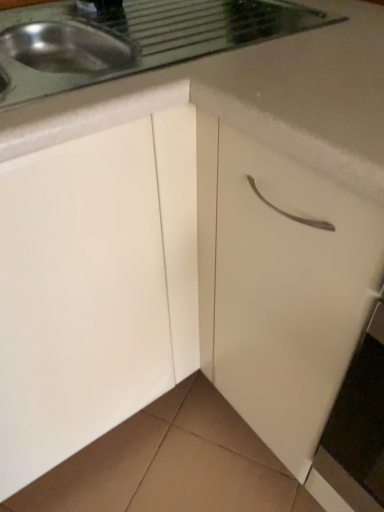
The width and height of the screenshot is (384, 512). Describe the element at coordinates (216, 77) in the screenshot. I see `white glossy countertop at upper center` at that location.

You are a GUI agent. You are given a task and a screenshot of the screen. Output one action in this format:
    pyautogui.click(x=<x>, y=<y>)
    Task: Click on the white glossy countertop at upper center
    
    Given the screenshot: What is the action you would take?
    pyautogui.click(x=216, y=77)

Measure the distance between point (202,57) and camera.

Point (202,57) and camera are 26.77 inches apart from each other.

This screenshot has width=384, height=512. I want to click on white matte drawer at center, so click(288, 293).

Describe the element at coordinates (288, 293) in the screenshot. I see `white matte drawer at center` at that location.

At what (x,y) coordinates should I click in order to perform the action: click on white glossy countertop at upper center. Please return your answer as a coordinate pair (x, y). Looking at the image, I should click on (216, 77).

Between white glossy countertop at upper center and white matte drawer at center, which one appears on the right side from the viewer's perspective?

From the viewer's perspective, white matte drawer at center appears more on the right side.

In the image, is white glossy countertop at upper center positioned in front of or behind white matte drawer at center?

Clearly, white glossy countertop at upper center is behind white matte drawer at center.

Which is closer, (x=251, y=102) or (x=261, y=272)?

Point (x=251, y=102) is positioned closer to the camera compared to point (x=261, y=272).

From the image's perspective, relative to white matte drawer at center, is white glossy countertop at upper center above or below?

Based on their image positions, white glossy countertop at upper center is located above white matte drawer at center.

From a real-world perspective, between white glossy countertop at upper center and white matte drawer at center, who is vertically higher?

white glossy countertop at upper center is physically above.

Considering the relative sizes of white glossy countertop at upper center and white matte drawer at center in the image provided, is white glossy countertop at upper center thinner than white matte drawer at center?

In fact, white glossy countertop at upper center might be wider than white matte drawer at center.

Considering the sizes of white glossy countertop at upper center and white matte drawer at center in the image, is white glossy countertop at upper center taller or shorter than white matte drawer at center?

Clearly, white glossy countertop at upper center is shorter compared to white matte drawer at center.

Between white glossy countertop at upper center and white matte drawer at center, which one has larger size?

white matte drawer at center.

Is white glossy countertop at upper center not within white matte drawer at center?

Absolutely, white glossy countertop at upper center is external to white matte drawer at center.

Is white glossy countertop at upper center with white matte drawer at center?

white glossy countertop at upper center is not next to white matte drawer at center, and they're not touching.

Is white glossy countertop at upper center oriented away from white matte drawer at center?

No, white matte drawer at center is not at the back of white glossy countertop at upper center.

Where is `drawer below the white glossy countertop at upper center (from the image's perspective)`? This screenshot has width=384, height=512. drawer below the white glossy countertop at upper center (from the image's perspective) is located at coordinates (288, 293).

Is white matte drawer at center at the left side of white glossy countertop at upper center?

Incorrect, white matte drawer at center is not on the left side of white glossy countertop at upper center.

Who is more distant, white matte drawer at center or white glossy countertop at upper center?

white glossy countertop at upper center.

Between point (265, 215) and point (220, 6), which one is positioned behind?

The point (220, 6) is farther.

From the image's perspective, which object appears higher, white matte drawer at center or white glossy countertop at upper center?

white glossy countertop at upper center, from the image's perspective.

From a real-world perspective, which is physically below, white matte drawer at center or white glossy countertop at upper center?

white matte drawer at center is physically lower.

Is white matte drawer at center thinner than white glossy countertop at upper center?

Indeed, white matte drawer at center has a lesser width compared to white glossy countertop at upper center.

Between white matte drawer at center and white glossy countertop at upper center, which one has more height?

white matte drawer at center.

Is white matte drawer at center smaller than white glossy countertop at upper center?

Actually, white matte drawer at center might be larger than white glossy countertop at upper center.

Is white matte drawer at center situated inside white glossy countertop at upper center or outside?

white matte drawer at center is not enclosed by white glossy countertop at upper center.

Is white matte drawer at center far from white glossy countertop at upper center?

No.

Does white matte drawer at center turn towards white glossy countertop at upper center?

No, white matte drawer at center does not turn towards white glossy countertop at upper center.

Can you tell me how much white matte drawer at center and white glossy countertop at upper center differ in facing direction?

They differ by 89.6 degrees in their facing directions.

Find the location of a particular element. This screenshot has height=512, width=384. countertop that is behind the white matte drawer at center is located at coordinates (216, 77).

Find the location of `drawer located on the right of white glossy countertop at upper center`. drawer located on the right of white glossy countertop at upper center is located at coordinates (288, 293).

Locate an element on the screen. countertop behind the white matte drawer at center is located at coordinates (216, 77).